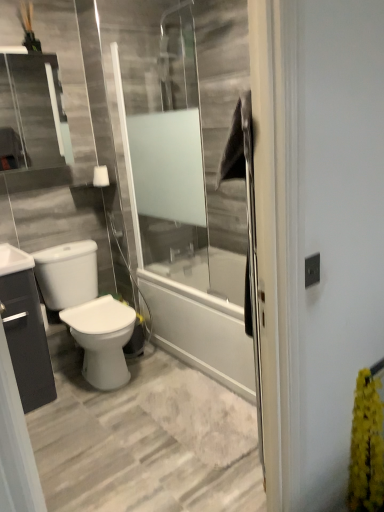
Where is `vacant space to the right of matte black cabinet at left`? This screenshot has height=512, width=384. vacant space to the right of matte black cabinet at left is located at coordinates (66, 397).